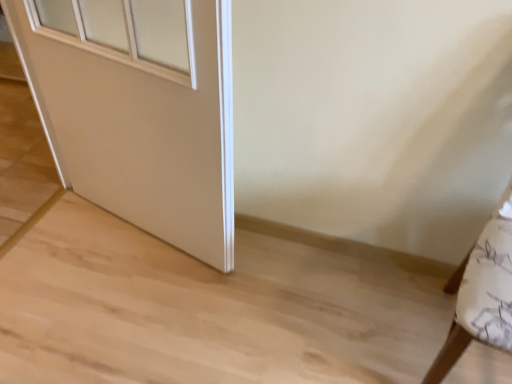
Question: Would you say white fabric cushion at right is to the left or to the right of white matte door at center in the picture?

Choices:
 (A) right
 (B) left

Answer: (A)

Question: Is white fabric cushion at right wider or thinner than white matte door at center?

Choices:
 (A) thin
 (B) wide

Answer: (B)

Question: Relative to white matte door at center, is white fabric cushion at right in front or behind?

Choices:
 (A) front
 (B) behind

Answer: (A)

Question: From the image's perspective, is white matte door at center located above or below white fabric cushion at right?

Choices:
 (A) below
 (B) above

Answer: (B)

Question: Considering the relative positions of white matte door at center and white fabric cushion at right in the image provided, is white matte door at center to the left or to the right of white fabric cushion at right?

Choices:
 (A) left
 (B) right

Answer: (A)

Question: From a real-world perspective, is white matte door at center above or below white fabric cushion at right?

Choices:
 (A) above
 (B) below

Answer: (A)

Question: Considering the positions of white matte door at center and white fabric cushion at right in the image, is white matte door at center bigger or smaller than white fabric cushion at right?

Choices:
 (A) small
 (B) big

Answer: (B)